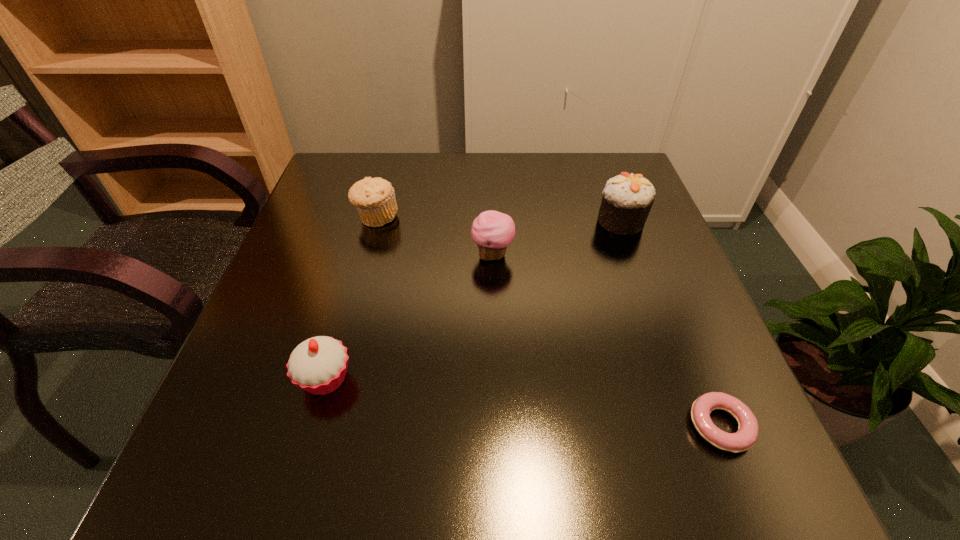
Image resolution: width=960 pixels, height=540 pixels. Find the location of `the rightmost cupcake`. the rightmost cupcake is located at coordinates (627, 199).

Locate an element on the screen. The width and height of the screenshot is (960, 540). the second cupcake from right to left is located at coordinates (492, 231).

The image size is (960, 540). I want to click on the third farthest object, so click(x=492, y=231).

Where is `muffin`? The height and width of the screenshot is (540, 960). muffin is located at coordinates (374, 198).

Identify the location of the leftmost cupcake. (318, 365).

Locate an element on the screen. The width and height of the screenshot is (960, 540). doughnut is located at coordinates (746, 436).

This screenshot has width=960, height=540. I want to click on vacant space located on the left of the rightmost cupcake, so (x=508, y=221).

Image resolution: width=960 pixels, height=540 pixels. In order to click on free space located 0.250m on the front of the third nearest object in this screenshot , I will do `click(496, 372)`.

In order to click on blank space located on the front of the muffin in this screenshot , I will do `click(333, 377)`.

Locate an element on the screen. This screenshot has height=540, width=960. free space located on the front of the nearest cupcake is located at coordinates (309, 435).